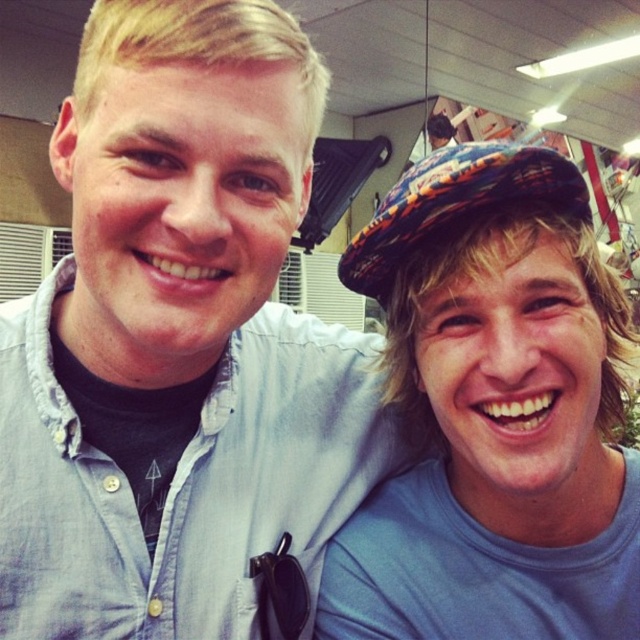
Question: Which object is the closest to the blue denim shirt at center?

Choices:
 (A) plaid fabric hat at upper right
 (B) blue fabric shirt at right

Answer: (B)

Question: Does blue denim shirt at center appear on the left side of blue fabric shirt at right?

Choices:
 (A) no
 (B) yes

Answer: (B)

Question: Which point is closer to the camera taking this photo?

Choices:
 (A) (449, 204)
 (B) (134, 333)
 (C) (451, 557)

Answer: (B)

Question: Is blue denim shirt at center above plaid fabric hat at upper right?

Choices:
 (A) no
 (B) yes

Answer: (A)

Question: Which object is closer to the camera taking this photo?

Choices:
 (A) plaid fabric hat at upper right
 (B) blue fabric shirt at right

Answer: (A)

Question: Can you confirm if blue fabric shirt at right is positioned to the right of plaid fabric hat at upper right?

Choices:
 (A) yes
 (B) no

Answer: (A)